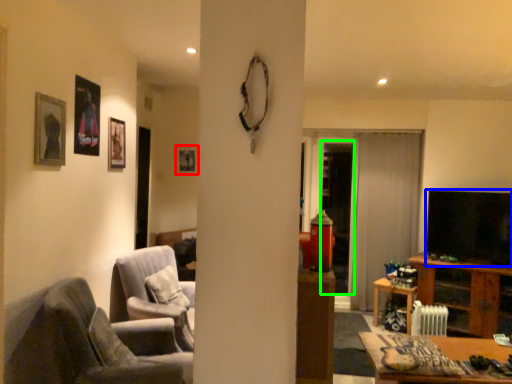
Question: Considering the real-world distances, which object is farthest from picture frame (highlighted by a red box)? television (highlighted by a blue box) or glass door (highlighted by a green box)?

Choices:
 (A) television
 (B) glass door

Answer: (A)